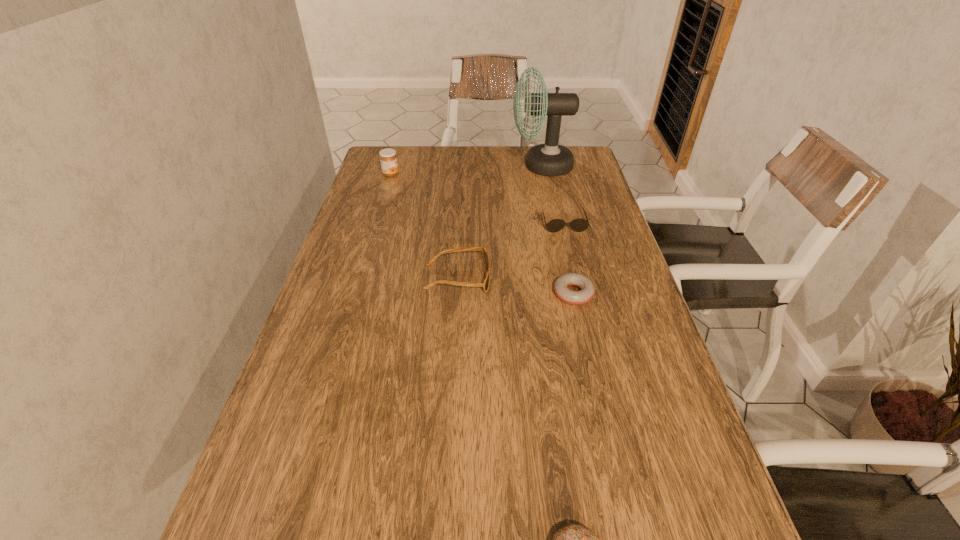
Identify the location of free space between the tallest object and the fourth nearest object. (553, 195).

Locate an element on the screen. This screenshot has width=960, height=540. the fourth closest object to the nearest object is located at coordinates (550, 159).

The width and height of the screenshot is (960, 540). I want to click on object that can be found as the fourth closest to the left sunglasses, so click(x=388, y=159).

Locate an element on the screen. vacant area that satisfies the following two spatial constraints: 1. on the front-facing side of the farther doughnut; 2. on the right side of the left sunglasses is located at coordinates (457, 293).

Find the location of a particular element. The image size is (960, 540). blank space that satisfies the following two spatial constraints: 1. in front of the farther doughnut where the airflow is directed; 2. on the right side of the fan is located at coordinates (569, 293).

The width and height of the screenshot is (960, 540). What are the coordinates of `free space that satisfies the following two spatial constraints: 1. in front of the farther doughnut where the airflow is directed; 2. on the right side of the fan` in the screenshot? It's located at [x=569, y=293].